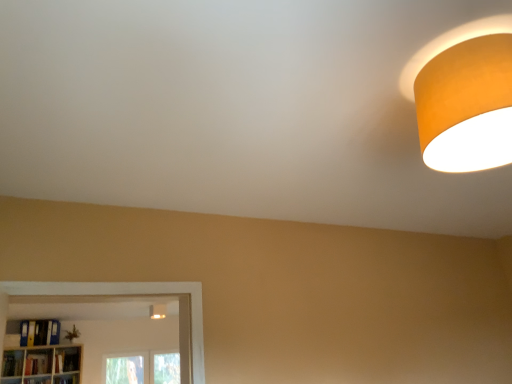
This screenshot has width=512, height=384. Describe the element at coordinates (467, 106) in the screenshot. I see `orange matte lampshade at upper right, which is counted as the 2th lamp, starting from the bottom` at that location.

Measure the distance between point (45,336) and camera.

Point (45,336) and camera are 2.50 meters apart.

Describe the element at coordinates (67, 359) in the screenshot. This screenshot has width=512, height=384. I see `hardcover book at lower left, positioned as the first book in right-to-left order` at that location.

What do you see at coordinates (12, 363) in the screenshot? The width and height of the screenshot is (512, 384). I see `hardcover book at lower left, which ranks as the 4th book in right-to-left order` at bounding box center [12, 363].

At what (x,y) coordinates should I click in order to perform the action: click on orange matte lampshade at upper right, the 2th lamp from the left. Please return your answer as a coordinate pair (x, y). This screenshot has width=512, height=384. Looking at the image, I should click on (467, 106).

Considering the sizes of orange matte lampshade at upper right, which is the 1th lamp in right-to-left order, and wooden bookshelf at lower left, which ranks as the first shelf in left-to-right order, in the image, is orange matte lampshade at upper right, which is the 1th lamp in right-to-left order, taller or shorter than wooden bookshelf at lower left, which ranks as the first shelf in left-to-right order,?

Considering their sizes, orange matte lampshade at upper right, which is the 1th lamp in right-to-left order, has more height than wooden bookshelf at lower left, which ranks as the first shelf in left-to-right order.

Which point is more distant from viewer, (432, 81) or (38, 379)?

The point (38, 379) is farther.

Is orange matte lampshade at upper right, the 1th lamp in the front-to-back sequence, positioned with its back to wooden bookshelf at lower left, the second shelf positioned from the right?

No, orange matte lampshade at upper right, the 1th lamp in the front-to-back sequence, is not facing away from wooden bookshelf at lower left, the second shelf positioned from the right.

Which object is thinner, orange matte lampshade at upper right, arranged as the second lamp when viewed from the back, or wooden bookshelf at lower left, which ranks as the first shelf in left-to-right order?

wooden bookshelf at lower left, which ranks as the first shelf in left-to-right order, is thinner.

How far apart are hardcover book at lower left, which is the 2th book in left-to-right order, and hardcover book at lower left, which ranks as the 4th book in right-to-left order?

hardcover book at lower left, which is the 2th book in left-to-right order, and hardcover book at lower left, which ranks as the 4th book in right-to-left order, are 3.07 inches apart from each other.

Which of these two, hardcover book at lower left, which is the 3th book from right to left, or hardcover book at lower left, which ranks as the 4th book in right-to-left order, is bigger?

hardcover book at lower left, which is the 3th book from right to left, is bigger.

Can you confirm if hardcover book at lower left, which is the 2th book in left-to-right order, is wider than hardcover book at lower left, which ranks as the 4th book in right-to-left order?

Incorrect, the width of hardcover book at lower left, which is the 2th book in left-to-right order, does not surpass that of hardcover book at lower left, which ranks as the 4th book in right-to-left order.

Between hardcover book at lower left, which is the 3th book from right to left, and hardcover book at lower left, the 1th book when ordered from left to right, which one appears on the left side from the viewer's perspective?

From the viewer's perspective, hardcover book at lower left, the 1th book when ordered from left to right, appears more on the left side.

Which is behind, point (426, 77) or point (59, 372)?

The point (59, 372) is more distant.

Is orange matte lampshade at upper right, which is the 1th lamp in right-to-left order, facing away from hardcover book at lower left, which ranks as the 4th book in left-to-right order?

That's not correct — orange matte lampshade at upper right, which is the 1th lamp in right-to-left order, is not looking away from hardcover book at lower left, which ranks as the 4th book in left-to-right order.

Considering the sizes of orange matte lampshade at upper right, which is counted as the 2th lamp, starting from the bottom, and hardcover book at lower left, positioned as the first book in right-to-left order, in the image, is orange matte lampshade at upper right, which is counted as the 2th lamp, starting from the bottom, wider or thinner than hardcover book at lower left, positioned as the first book in right-to-left order,?

Considering their sizes, orange matte lampshade at upper right, which is counted as the 2th lamp, starting from the bottom, looks broader than hardcover book at lower left, positioned as the first book in right-to-left order.

Starting from the wooden bookshelf at lower left, positioned as the first shelf in right-to-left order, which book is the 2nd one to the left? Please provide its 2D coordinates.

[(38, 364)]

Considering the relative sizes of wooden bookshelf at lower left, positioned as the first shelf in right-to-left order, and hardcover book at lower left, which is the 2th book in left-to-right order, in the image provided, is wooden bookshelf at lower left, positioned as the first shelf in right-to-left order, bigger than hardcover book at lower left, which is the 2th book in left-to-right order,?

Actually, wooden bookshelf at lower left, positioned as the first shelf in right-to-left order, might be smaller than hardcover book at lower left, which is the 2th book in left-to-right order.

From a real-world perspective, is wooden bookshelf at lower left, arranged as the second shelf when viewed from the left, positioned above or below hardcover book at lower left, which is the 2th book in left-to-right order?

Answer: Clearly, from a real-world perspective, wooden bookshelf at lower left, arranged as the second shelf when viewed from the left, is below hardcover book at lower left, which is the 2th book in left-to-right order.

Who is shorter, wooden bookshelf at lower left, the second shelf positioned from the right, or orange matte lampshade at upper right, which is the 1th lamp from top to bottom?

wooden bookshelf at lower left, the second shelf positioned from the right.

Considering the positions of points (42, 377) and (424, 84), is point (42, 377) closer to camera compared to point (424, 84)?

No.

This screenshot has height=384, width=512. What are the coordinates of `the 2nd shelf to the left when counting from the orange matte lampshade at upper right, which is the 1th lamp from top to bottom` in the screenshot? It's located at click(x=37, y=380).

Is wooden bookshelf at lower left, which ranks as the first shelf in left-to-right order, in front of orange matte lampshade at upper right, which is counted as the 2th lamp, starting from the bottom?

No, it is behind orange matte lampshade at upper right, which is counted as the 2th lamp, starting from the bottom.

From the image's perspective, is wooden bookshelf at lower left, which ranks as the first shelf in left-to-right order, located above wooden bookshelf at lower left, positioned as the first shelf in right-to-left order?

Yes.

From a real-world perspective, is wooden bookshelf at lower left, the second shelf positioned from the right, under wooden bookshelf at lower left, arranged as the second shelf when viewed from the left?

Incorrect, from a real-world perspective, wooden bookshelf at lower left, the second shelf positioned from the right, is higher than wooden bookshelf at lower left, arranged as the second shelf when viewed from the left.

Which of these two, wooden bookshelf at lower left, which ranks as the first shelf in left-to-right order, or wooden bookshelf at lower left, positioned as the first shelf in right-to-left order, stands taller?

wooden bookshelf at lower left, positioned as the first shelf in right-to-left order.

Is wooden bookshelf at lower left, which ranks as the first shelf in left-to-right order, oriented away from wooden bookshelf at lower left, positioned as the first shelf in right-to-left order?

No, wooden bookshelf at lower left, which ranks as the first shelf in left-to-right order, is not facing away from wooden bookshelf at lower left, positioned as the first shelf in right-to-left order.

Is point (35, 382) positioned behind point (6, 353)?

No, it is not.

Considering the sizes of objects wooden bookshelf at lower left, which ranks as the first shelf in left-to-right order, and hardcover book at lower left, the 1th book when ordered from left to right, in the image provided, who is smaller, wooden bookshelf at lower left, which ranks as the first shelf in left-to-right order, or hardcover book at lower left, the 1th book when ordered from left to right,?

wooden bookshelf at lower left, which ranks as the first shelf in left-to-right order, is smaller.

What's the angular difference between wooden bookshelf at lower left, which ranks as the first shelf in left-to-right order, and hardcover book at lower left, the 1th book when ordered from left to right,'s facing directions?

They differ by 0.0011 degrees in their facing directions.

Considering the relative positions of wooden bookshelf at lower left, which ranks as the first shelf in left-to-right order, and hardcover book at lower left, the 1th book when ordered from left to right, in the image provided, is wooden bookshelf at lower left, which ranks as the first shelf in left-to-right order, behind hardcover book at lower left, the 1th book when ordered from left to right,?

Yes, wooden bookshelf at lower left, which ranks as the first shelf in left-to-right order, is further from the camera.

I want to click on the 2nd lamp to the right of the wooden bookshelf at lower left, which ranks as the first shelf in left-to-right order, starting your count from the anchor, so pyautogui.click(x=467, y=106).

From a real-world perspective, count 1st books upward from the hardcover book at lower left, the 1th book when ordered from left to right, and point to it. Please provide its 2D coordinates.

[(38, 364)]

Considering their positions, is wooden bookshelf at lower left, the second shelf positioned from the right, positioned further to orange matte lampshade at upper right, which is the 1th lamp in right-to-left order, than hardcover book at lower left, which ranks as the 4th book in right-to-left order?

The object further to orange matte lampshade at upper right, which is the 1th lamp in right-to-left order, is hardcover book at lower left, which ranks as the 4th book in right-to-left order.

Which object lies nearer to the anchor point yellow matte folder at lower left, positioned as the third book in left-to-right order, hardcover book at lower left, which is the 3th book from right to left, or hardcover book at lower left, the 1th book when ordered from left to right?

hardcover book at lower left, which is the 3th book from right to left, is closer to yellow matte folder at lower left, positioned as the third book in left-to-right order.

Considering their positions, is hardcover book at lower left, the 1th book when ordered from left to right, positioned closer to hardcover book at lower left, which ranks as the 4th book in left-to-right order, than wooden bookshelf at lower left, the second shelf positioned from the right?

wooden bookshelf at lower left, the second shelf positioned from the right.

When comparing their distances from hardcover book at lower left, which is the 3th book from right to left, does wooden bookshelf at lower left, which ranks as the first shelf in left-to-right order, or hardcover book at lower left, positioned as the first book in right-to-left order, seem further?

Based on the image, hardcover book at lower left, positioned as the first book in right-to-left order, appears to be further to hardcover book at lower left, which is the 3th book from right to left.

Estimate the real-world distances between objects in this image. Which object is closer to hardcover book at lower left, which is the 2th book in left-to-right order, hardcover book at lower left, the 1th book when ordered from left to right, or yellow matte folder at lower left, positioned as the third book in left-to-right order?

Based on the image, hardcover book at lower left, the 1th book when ordered from left to right, appears to be nearer to hardcover book at lower left, which is the 2th book in left-to-right order.

Based on their spatial positions, is hardcover book at lower left, the 1th book when ordered from left to right, or hardcover book at lower left, which is the 3th book from right to left, further from orange matte lampshade at upper right, the 1th lamp in the front-to-back sequence?

Based on the image, hardcover book at lower left, the 1th book when ordered from left to right, appears to be further to orange matte lampshade at upper right, the 1th lamp in the front-to-back sequence.

From the image, which object appears to be nearer to orange matte lampshade at upper right, which is counted as the 2th lamp, starting from the bottom, hardcover book at lower left, which is the 3th book from right to left, or yellow matte folder at lower left, which is counted as the second book, starting from the right?

Based on the image, yellow matte folder at lower left, which is counted as the second book, starting from the right, appears to be nearer to orange matte lampshade at upper right, which is counted as the 2th lamp, starting from the bottom.

Which object lies further to the anchor point matte white light fixture at lower center, which ranks as the second lamp in top-to-bottom order, orange matte lampshade at upper right, which is counted as the 2th lamp, starting from the bottom, or wooden bookshelf at lower left, which ranks as the first shelf in left-to-right order?

Among the two, orange matte lampshade at upper right, which is counted as the 2th lamp, starting from the bottom, is located further to matte white light fixture at lower center, which ranks as the second lamp in top-to-bottom order.

Identify the location of shelf between orange matte lampshade at upper right, the 1th lamp in the front-to-back sequence, and hardcover book at lower left, which is the 2th book in left-to-right order, along the z-axis. This screenshot has width=512, height=384. (37, 380).

This screenshot has height=384, width=512. Find the location of `shelf located between hardcover book at lower left, the 1th book when ordered from left to right, and wooden bookshelf at lower left, arranged as the second shelf when viewed from the left, in the left-right direction`. shelf located between hardcover book at lower left, the 1th book when ordered from left to right, and wooden bookshelf at lower left, arranged as the second shelf when viewed from the left, in the left-right direction is located at coordinates (37, 380).

Image resolution: width=512 pixels, height=384 pixels. I want to click on book positioned between orange matte lampshade at upper right, which is the 1th lamp in right-to-left order, and yellow matte folder at lower left, which is counted as the second book, starting from the right, from near to far, so click(x=12, y=363).

This screenshot has height=384, width=512. In order to click on shelf between orange matte lampshade at upper right, the 2th lamp from the left, and wooden bookshelf at lower left, arranged as the second shelf when viewed from the left, along the z-axis in this screenshot , I will do `click(37, 380)`.